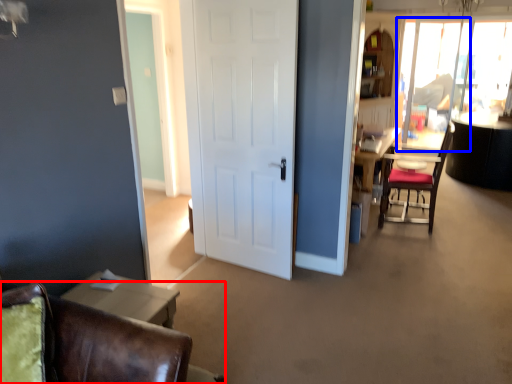
Question: Which of the following is the farthest to the observer, chair (highlighted by a red box) or window screen (highlighted by a blue box)?

Choices:
 (A) chair
 (B) window screen

Answer: (B)